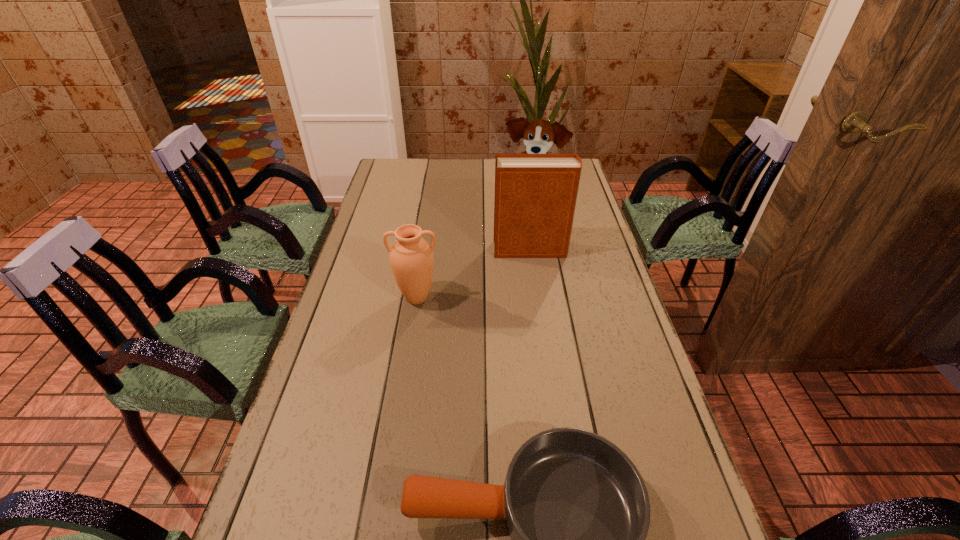
I want to click on hardback book that is at the right edge, so click(535, 194).

You are a GUI agent. You are given a task and a screenshot of the screen. Output one action in this format:
    pyautogui.click(x=<x>, y=<y>)
    Task: Click on the free space at the far edge
    The height and width of the screenshot is (540, 960).
    Given the screenshot: What is the action you would take?
    pyautogui.click(x=489, y=170)

The width and height of the screenshot is (960, 540). Identify the location of vacant area at the left edge of the desktop. (305, 450).

Locate an element on the screen. This screenshot has width=960, height=540. vacant area at the right edge of the desktop is located at coordinates (691, 514).

Where is `free space at the far left corner of the desktop`? This screenshot has width=960, height=540. free space at the far left corner of the desktop is located at coordinates (390, 166).

You are a GUI agent. You are given a task and a screenshot of the screen. Output one action in this format:
    pyautogui.click(x=<x>, y=<y>)
    Task: Click on the vacant area between the hardback book and the second nearest object
    Image resolution: width=960 pixels, height=540 pixels.
    Given the screenshot: What is the action you would take?
    pyautogui.click(x=473, y=274)

Find the location of `free space between the urn and the farthest object`. free space between the urn and the farthest object is located at coordinates (474, 249).

Choose which object is the third nearest neighbor to the third nearest object. Please provide its 2D coordinates. Your answer should be formatted as a tuple, i.e. [(x, y)], where the tuple contains the x and y coordinates of a point satisfying the conditions above.

[(577, 510)]

Image resolution: width=960 pixels, height=540 pixels. In order to click on the closest object relative to the third farthest object in this screenshot , I will do `click(535, 194)`.

What are the coordinates of `vacant area in the image that satisfies the following two spatial constraints: 1. on the face of the farthest object; 2. on the open cover of the second farthest object` in the screenshot? It's located at (540, 250).